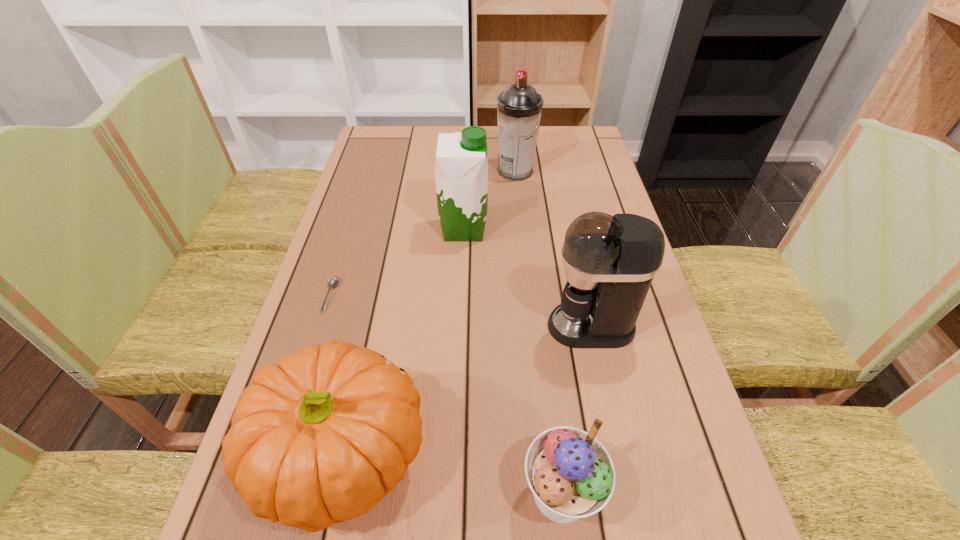
You are a GUI agent. You are given a task and a screenshot of the screen. Output one action in this format:
    pyautogui.click(x=<x>, y=<y>)
    Task: Click on the free location that satisfies the following two spatial constraints: 1. on the front-facing side of the soya milk; 2. on the right side of the icecream
    The width and height of the screenshot is (960, 540).
    Given the screenshot: What is the action you would take?
    pyautogui.click(x=453, y=493)

The width and height of the screenshot is (960, 540). I want to click on free point that satisfies the following two spatial constraints: 1. on the front side of the aerosol can; 2. on the right side of the second shortest object, so click(x=548, y=493).

The height and width of the screenshot is (540, 960). Identify the location of free space that satisfies the following two spatial constraints: 1. on the front-facing side of the soya milk; 2. on the right side of the fifth tallest object. (453, 493).